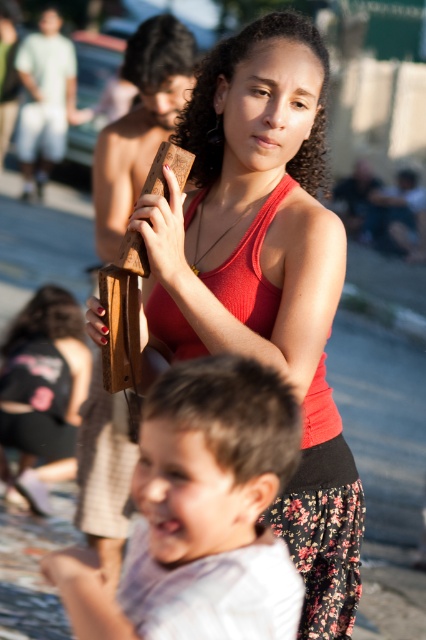
Question: Does matte wood block at center have a greater width compared to matte brown wooden object at center?

Choices:
 (A) yes
 (B) no

Answer: (A)

Question: Can you confirm if matte wood block at center is smaller than matte brown wooden object at center?

Choices:
 (A) no
 (B) yes

Answer: (A)

Question: Among these objects, which one is farthest from the camera?

Choices:
 (A) light brown hair at lower center
 (B) ribbed red tank top at center
 (C) matte brown wooden object at center
 (D) matte wood block at center

Answer: (C)

Question: Which point is farther from the camera taking this photo?

Choices:
 (A) (267, 474)
 (B) (259, 262)
 (C) (290, 529)
 (D) (60, 336)

Answer: (D)

Question: Where is matte wood block at center located in relation to matte brown wooden object at center in the image?

Choices:
 (A) above
 (B) below

Answer: (A)

Question: Based on their relative distances, which object is farther from the matte brown wooden object at center?

Choices:
 (A) matte wood block at center
 (B) ribbed red tank top at center
 (C) light brown hair at lower center

Answer: (C)